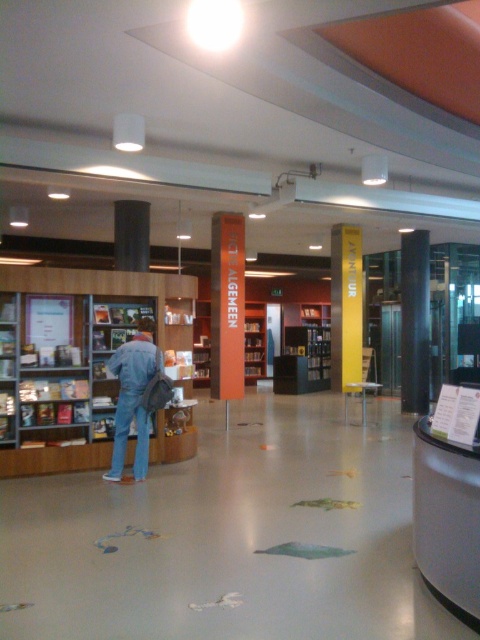
You are a visitor at the library and want to sit at the metallic gray desk at lower right to work. However, you need to pass by the orange matte bookshelf at center. Can you reach the desk without moving the bookshelf?

The metallic gray desk at lower right is below the orange matte bookshelf at center, so you can reach the desk by going around or behind the bookshelf since it is positioned above the desk.

You are a customer in the library and want to place a large book on the metallic gray desk at lower right. However, the book is as wide as the orange matte bookshelf at center. Can the book fit on the desk?

The metallic gray desk at lower right has a lesser width compared to orange matte bookshelf at center. Since the book is as wide as the orange matte bookshelf at center, it cannot fit on the metallic gray desk at lower right due to its narrower width.

You are a photographer standing in the library and want to take a photo of the denim jacket at center and the orange matte bookshelf at center. Which object should you focus on first if you want to capture both in the same frame without moving the camera?

The denim jacket at center is smaller than the orange matte bookshelf at center, so you should focus on the orange matte bookshelf at center first to ensure it is in sharp focus while the denim jacket at center will naturally be in the same plane of focus.